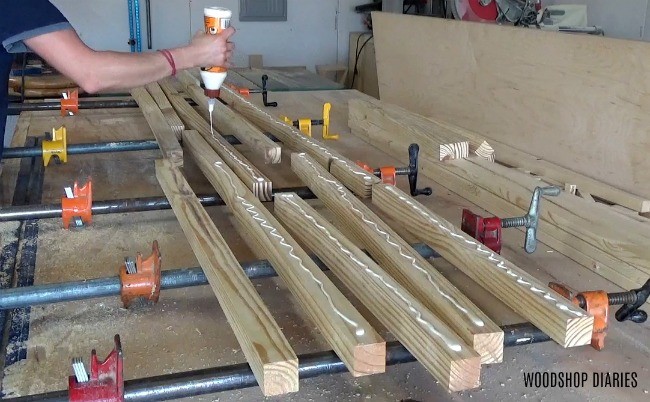
I want to click on plywood, so click(125, 170).